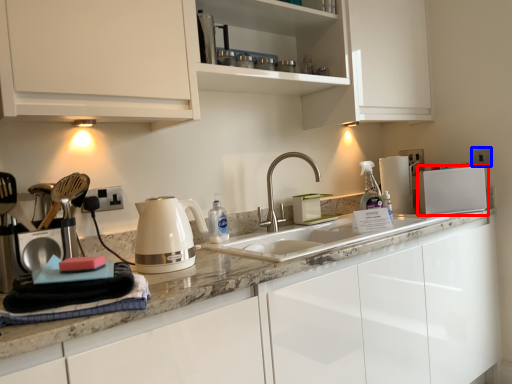
Question: Which point is closer to the camera, kitchen appliance (highlighted by a red box) or electric outlet (highlighted by a blue box)?

Choices:
 (A) kitchen appliance
 (B) electric outlet

Answer: (A)